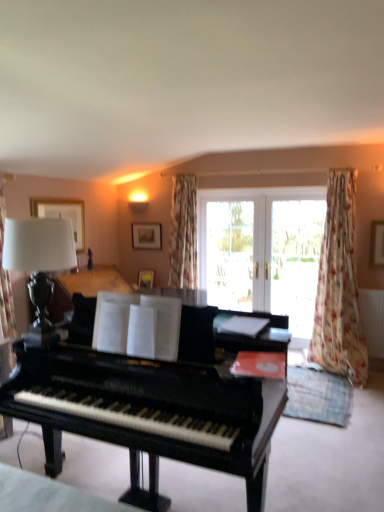
What is the approximate height of shiny black piano at center?

shiny black piano at center is 4.01 feet in height.

The image size is (384, 512). Describe the element at coordinates (262, 252) in the screenshot. I see `white glass doors at center` at that location.

Locate an element on the screen. white glass doors at center is located at coordinates (262, 252).

At what (x,y) coordinates should I click in order to perform the action: click on matte black lamp at left. Please return your answer as a coordinate pair (x, y). This screenshot has width=384, height=512. Looking at the image, I should click on (39, 264).

This screenshot has width=384, height=512. What do you see at coordinates (39, 264) in the screenshot?
I see `matte black lamp at left` at bounding box center [39, 264].

Identify the location of transparent glass screen door at center, the second screen door from the right. (228, 254).

Is matte black lamp at left facing away from shiny black piano at center?

No, matte black lamp at left is not facing the opposite direction of shiny black piano at center.

Find the location of a particular element. table lamp on the left of shiny black piano at center is located at coordinates (39, 264).

From a real-world perspective, is matte black lamp at left on top of shiny black piano at center?

Yes, from a real-world perspective, matte black lamp at left is on top of shiny black piano at center.

Locate an element on the screen. table lamp that appears above the transparent glass screen door at center, the second screen door from the right (from a real-world perspective) is located at coordinates (39, 264).

Is matte black lamp at left far from transparent glass screen door at center, the second screen door from the right?

Absolutely, matte black lamp at left is distant from transparent glass screen door at center, the second screen door from the right.

Is matte black lamp at left bigger or smaller than transparent glass screen door at center, the second screen door from the right?

Clearly, matte black lamp at left is smaller in size than transparent glass screen door at center, the second screen door from the right.

Locate an element on the screen. screen door that is the 2nd object located behind the matte black lamp at left is located at coordinates (228, 254).

Is transparent glass screen door at center, the second screen door from the right, next to matte black lamp at left?

transparent glass screen door at center, the second screen door from the right, is not next to matte black lamp at left, and they're not touching.

Which object is thinner, transparent glass screen door at center, the second screen door from the right, or matte black lamp at left?

With smaller width is transparent glass screen door at center, the second screen door from the right.

Which of these two, transparent glass screen door at center, the second screen door from the right, or matte black lamp at left, stands taller?

Standing taller between the two is transparent glass screen door at center, the second screen door from the right.

Does white glass doors at center appear on the left side of transparent glass screen door at center, the first screen door from the left?

Incorrect, white glass doors at center is not on the left side of transparent glass screen door at center, the first screen door from the left.

Does white glass doors at center come in front of transparent glass screen door at center, the second screen door from the right?

Yes, white glass doors at center is closer to the viewer.

From the picture: From a real-world perspective, is white glass doors at center beneath transparent glass screen door at center, the second screen door from the right?

Yes, from a real-world perspective, white glass doors at center is under transparent glass screen door at center, the second screen door from the right.

Looking at the image, does white glass doors at center seem bigger or smaller compared to transparent glass screen door at center, the first screen door from the left?

Clearly, white glass doors at center is larger in size than transparent glass screen door at center, the first screen door from the left.

From the image's perspective, relative to floral fabric curtain at right, is white glass doors at center above or below?

Clearly, from the image's perspective, white glass doors at center is above floral fabric curtain at right.

Find the location of `bay window located behind the floral fabric curtain at right`. bay window located behind the floral fabric curtain at right is located at coordinates pos(262,252).

Is white glass doors at center turned away from floral fabric curtain at right?

No, white glass doors at center's orientation is not away from floral fabric curtain at right.

Is shiny black piano at center turned away from transparent glass screen door at center, the first screen door from the left?

Absolutely, shiny black piano at center is directed away from transparent glass screen door at center, the first screen door from the left.

Is point (196, 385) farther from viewer compared to point (216, 245)?

No, it is in front of (216, 245).

Where is `piano on the left of transparent glass screen door at center, the first screen door from the left`? piano on the left of transparent glass screen door at center, the first screen door from the left is located at coordinates (148, 405).

Can you tell me how much shiny black piano at center and transparent glass screen door at center, the second screen door from the right, differ in facing direction?

The angle between the facing direction of shiny black piano at center and the facing direction of transparent glass screen door at center, the second screen door from the right, is 1.33 degrees.

Considering their positions, is white glass doors at center located in front of or behind transparent glass screen door at center, which is counted as the first screen door, starting from the right?

In the image, white glass doors at center appears behind transparent glass screen door at center, which is counted as the first screen door, starting from the right.

Is white glass doors at center touching transparent glass screen door at center, the 2th screen door positioned from the left?

There is a gap between white glass doors at center and transparent glass screen door at center, the 2th screen door positioned from the left.

From a real-world perspective, which is physically above, white glass doors at center or transparent glass screen door at center, which is counted as the first screen door, starting from the right?

transparent glass screen door at center, which is counted as the first screen door, starting from the right, is physically above.

Between white glass doors at center and transparent glass screen door at center, which is counted as the first screen door, starting from the right, which one has less height?

transparent glass screen door at center, which is counted as the first screen door, starting from the right.

I want to click on piano that is in front of the matte black lamp at left, so point(148,405).

Which screen door is the 2nd one when counting from the back of the matte black lamp at left? Please provide its 2D coordinates.

[(228, 254)]

Based on their spatial positions, is transparent glass screen door at center, the first screen door from the left, or white glass doors at center closer to floral fabric curtain at right?

Based on the image, white glass doors at center appears to be nearer to floral fabric curtain at right.

Estimate the real-world distances between objects in this image. Which object is closer to matte black lamp at left, transparent glass screen door at center, the second screen door from the right, or shiny black piano at center?

Among the two, shiny black piano at center is located nearer to matte black lamp at left.

When comparing their distances from shiny black piano at center, does white glass doors at center or transparent glass screen door at center, the second screen door from the right, seem closer?

white glass doors at center lies closer to shiny black piano at center than the other object.

Looking at the image, which one is located further to floral fabric curtain at right, white glass doors at center or transparent glass screen door at center, the second screen door from the right?

The object further to floral fabric curtain at right is transparent glass screen door at center, the second screen door from the right.

From the image, which object appears to be nearer to transparent glass screen door at center, the second screen door from the right, shiny black piano at center or transparent glass screen door at center, the 2th screen door positioned from the left?

transparent glass screen door at center, the 2th screen door positioned from the left, lies closer to transparent glass screen door at center, the second screen door from the right, than the other object.

Which object lies further to the anchor point shiny black piano at center, transparent glass screen door at center, the first screen door from the left, or matte black lamp at left?

The object further to shiny black piano at center is transparent glass screen door at center, the first screen door from the left.

Looking at the image, which one is located further to transparent glass screen door at center, the second screen door from the right, matte black lamp at left or white glass doors at center?

Among the two, matte black lamp at left is located further to transparent glass screen door at center, the second screen door from the right.

Which object lies further to the anchor point transparent glass screen door at center, the 2th screen door positioned from the left, matte black lamp at left or transparent glass screen door at center, the second screen door from the right?

matte black lamp at left is further to transparent glass screen door at center, the 2th screen door positioned from the left.

Locate an element on the screen. The height and width of the screenshot is (512, 384). screen door between matte black lamp at left and white glass doors at center along the z-axis is located at coordinates (296, 260).

The image size is (384, 512). I want to click on curtain between matte black lamp at left and transparent glass screen door at center, the 2th screen door positioned from the left, along the z-axis, so click(x=339, y=287).

You are a GUI agent. You are given a task and a screenshot of the screen. Output one action in this format:
    pyautogui.click(x=<x>, y=<y>)
    Task: Click on the bay window between shiny black piano at center and transparent glass screen door at center, the second screen door from the right, in the front-back direction
    This screenshot has height=512, width=384.
    Given the screenshot: What is the action you would take?
    click(262, 252)

Locate an element on the screen. bay window between matte black lamp at left and transparent glass screen door at center, the first screen door from the left, along the z-axis is located at coordinates (262, 252).